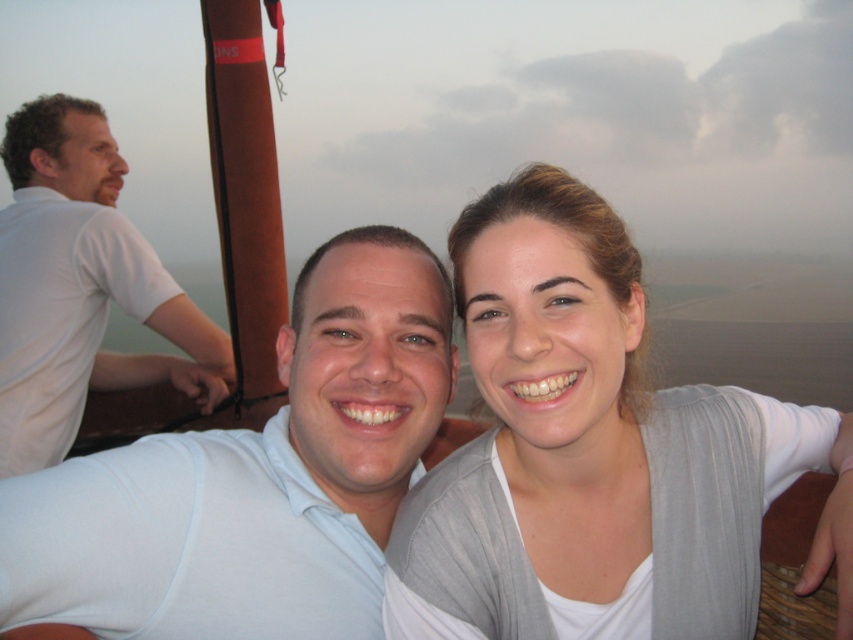
You are a photographer trying to capture a closeup of the light gray knit cardigan at center and the white matte shirt at center. Which one will you need to zoom in more on to get a detailed shot?

The light gray knit cardigan at center is shorter than the white matte shirt at center, so you will need to zoom in more on the light gray knit cardigan at center to get a detailed shot.